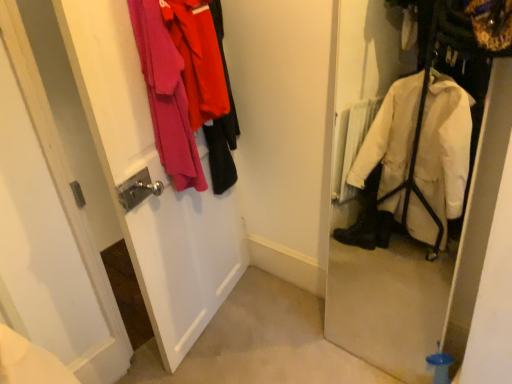
I want to click on vacant area that lies in front of white matte door at left, so click(x=220, y=356).